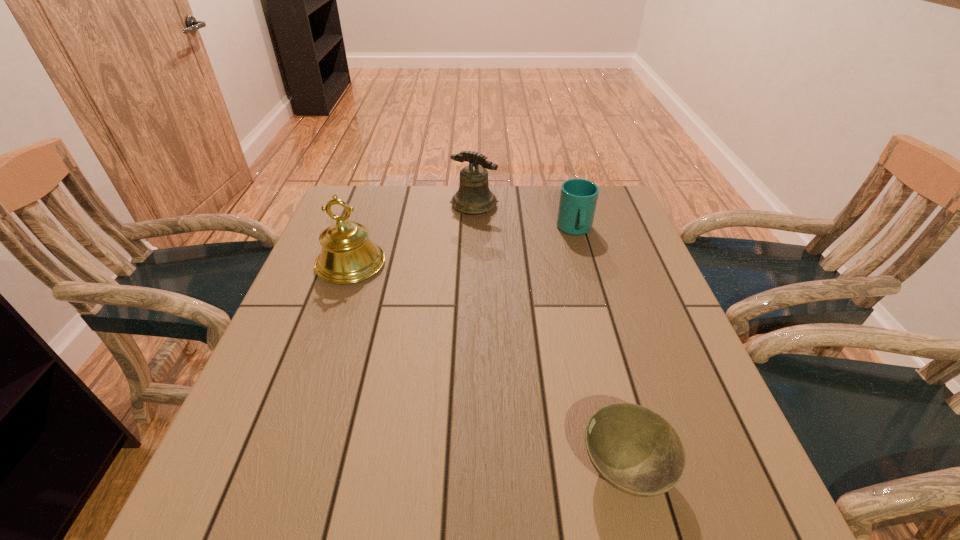
Locate an element on the screen. free space between the second object from left to right and the nearer bell is located at coordinates (413, 235).

The image size is (960, 540). Find the location of `free space between the left bell and the shortest object`. free space between the left bell and the shortest object is located at coordinates (488, 367).

The height and width of the screenshot is (540, 960). In order to click on free space between the leftmost object and the bowl in this screenshot , I will do `click(488, 367)`.

The image size is (960, 540). In order to click on unoccupied position between the second shortest object and the third object from right to left in this screenshot , I will do `click(524, 218)`.

Image resolution: width=960 pixels, height=540 pixels. I want to click on the closest object to the second object from left to right, so click(578, 197).

Select which object appears as the closest to the bowl. Please provide its 2D coordinates. Your answer should be formatted as a tuple, i.e. [(x, y)], where the tuple contains the x and y coordinates of a point satisfying the conditions above.

[(578, 197)]